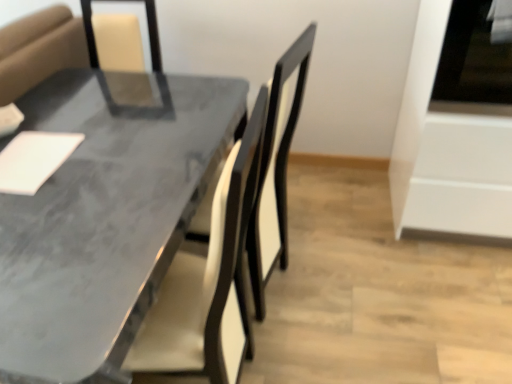
Locate an element on the screen. vacant area in front of white glossy oven at right is located at coordinates (451, 299).